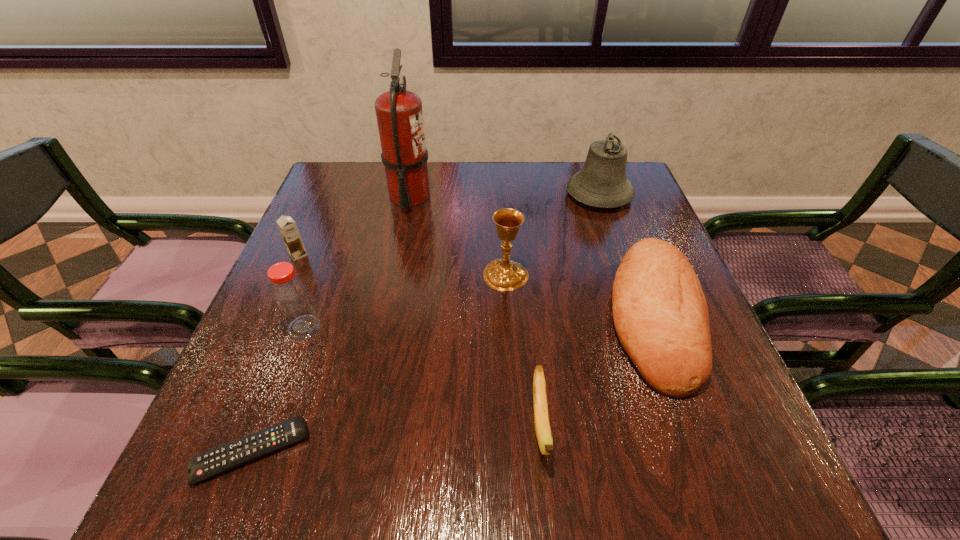
Where is `free space between the chocolate milk and the fourth object from left to right`? Image resolution: width=960 pixels, height=540 pixels. free space between the chocolate milk and the fourth object from left to right is located at coordinates (354, 226).

Where is `vacant area that lies between the chalice and the bottle`? The width and height of the screenshot is (960, 540). vacant area that lies between the chalice and the bottle is located at coordinates point(405,301).

Point out which object is positioned as the fourth nearest to the remote control. Please provide its 2D coordinates. Your answer should be formatted as a tuple, i.e. [(x, y)], where the tuple contains the x and y coordinates of a point satisfying the conditions above.

[(504, 274)]

I want to click on object that stands as the seventh closest to the bottle, so click(x=602, y=182).

At what (x,y) coordinates should I click in order to perform the action: click on vacant space that satisfies the following two spatial constraints: 1. toward the nozzle of the bread; 2. on the right side of the tallest object. Please return your answer as a coordinate pair (x, y). This screenshot has height=540, width=960. Looking at the image, I should click on (385, 317).

You are a GUI agent. You are given a task and a screenshot of the screen. Output one action in this format:
    pyautogui.click(x=<x>, y=<y>)
    Task: Click on the free location that satisfies the following two spatial constraints: 1. on the back side of the chalice; 2. toward the nozzle of the tallest object
    This screenshot has height=540, width=960.
    Given the screenshot: What is the action you would take?
    pyautogui.click(x=501, y=197)